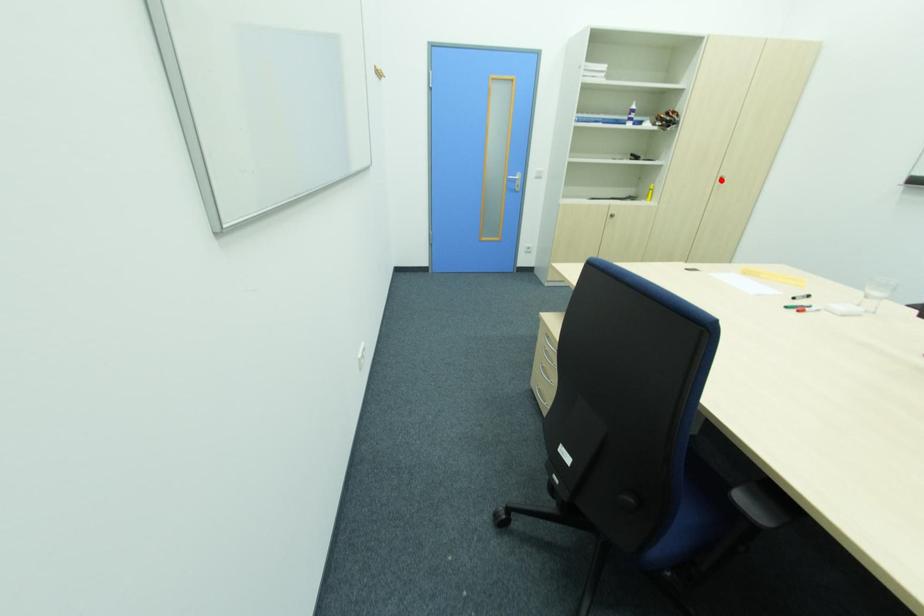
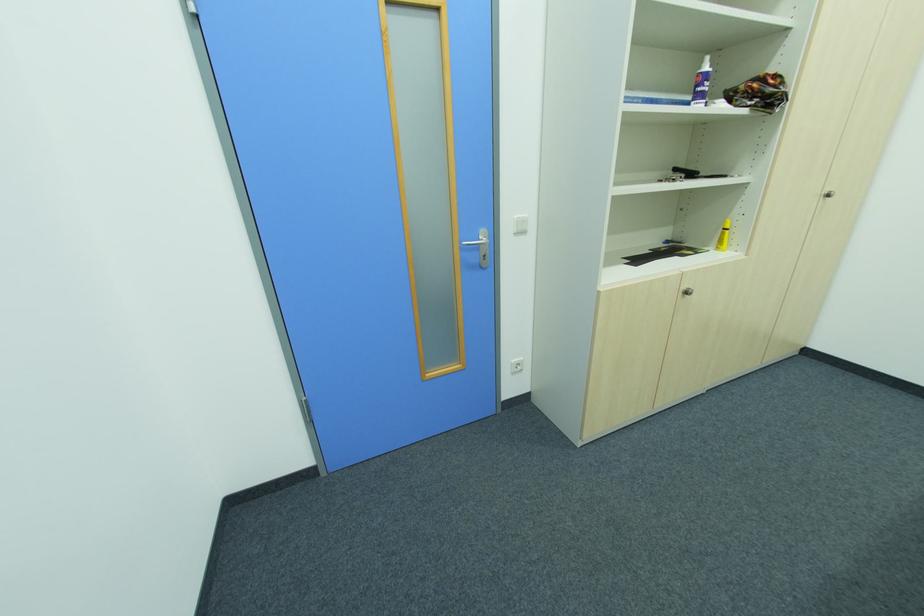
In the second image, find the point that corresponds to the highlighted location in the first image.

(822, 198)